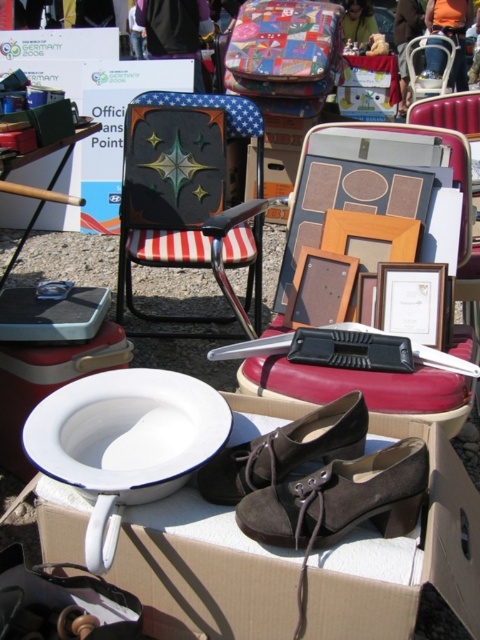
Is point (169, 497) positioned before point (135, 392)?

That is True.

Between point (465, 563) and point (127, 433), which one is positioned behind?

Point (127, 433)

Between point (78, 556) and point (203, 449), which one is positioned behind?

The point (78, 556) is more distant.

The image size is (480, 640). I want to click on white cardboard box at center, so click(x=403, y=554).

The width and height of the screenshot is (480, 640). What are the coordinates of `metallic painted chair at center` in the screenshot? It's located at (177, 182).

Who is more distant from viewer, (142, 132) or (343, 435)?

Positioned behind is point (142, 132).

Locate an element on the screen. This screenshot has height=640, width=480. metallic painted chair at center is located at coordinates (177, 182).

Can you confirm if white enameled toilet bowl at lower left is taller than metallic silver chair at upper center?

No.

Does white enameled toilet bowl at lower left come behind metallic silver chair at upper center?

No, white enameled toilet bowl at lower left is in front of metallic silver chair at upper center.

Which is in front, point (118, 458) or point (416, 68)?

Point (118, 458) is in front.

At what (x,y) coordinates should I click in order to perform the action: click on white enameled toilet bowl at lower left. Please return your answer as a coordinate pair (x, y). Looking at the image, I should click on (124, 442).